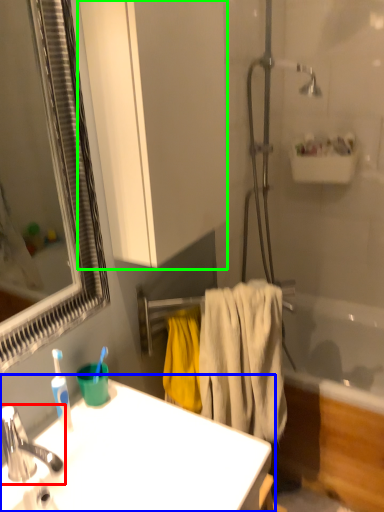
Question: Which object is positioned closest to tap (highlighted by a red box)? Select from sink (highlighted by a blue box) and bathroom cabinet (highlighted by a green box).

Choices:
 (A) sink
 (B) bathroom cabinet

Answer: (A)